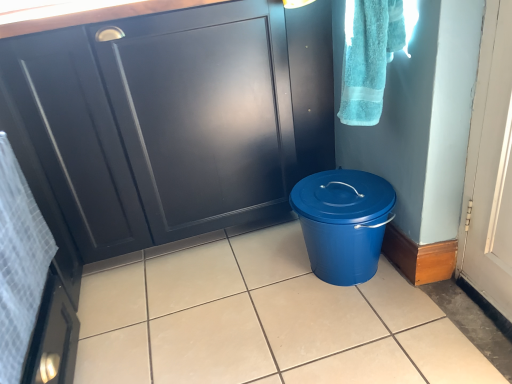
You are a GUI agent. You are given a task and a screenshot of the screen. Output one action in this format:
    pyautogui.click(x=<x>, y=<y>)
    Task: Click on the vacant space behind white textured towel at left, the 1th bath towel in the bottom-to-top sequence
    The height and width of the screenshot is (384, 512).
    Given the screenshot: What is the action you would take?
    pyautogui.click(x=129, y=310)